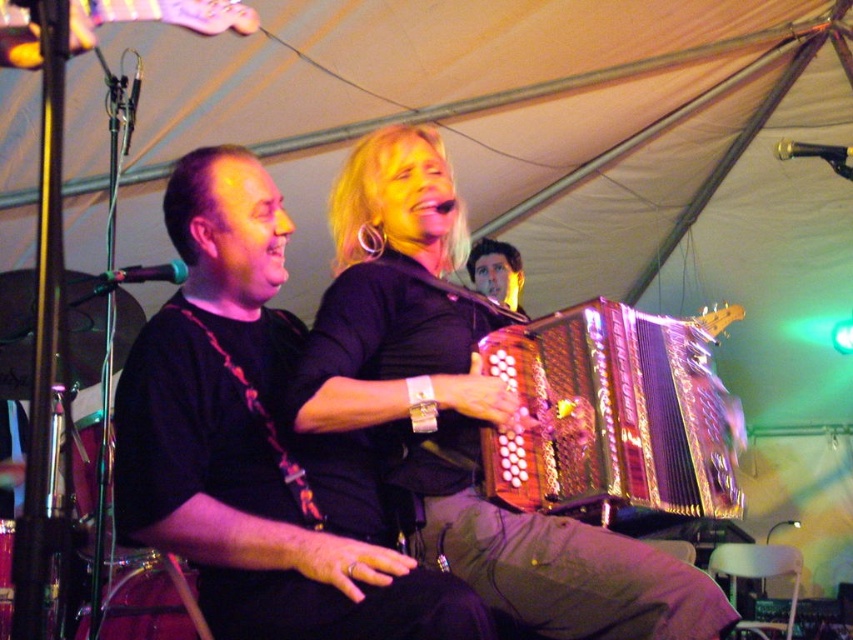
Question: Estimate the real-world distances between objects in this image. Which object is closer to the metallic pink guitar at upper left?

Choices:
 (A) black fabric shirt at center
 (B) gold metallic accordion at center
 (C) shiny black hair at upper center

Answer: (A)

Question: Which of the following is the farthest from the observer?

Choices:
 (A) (x=424, y=209)
 (B) (x=730, y=308)
 (C) (x=287, y=529)
 (D) (x=157, y=4)

Answer: (B)

Question: Where is black fabric shirt at center located in relation to metallic pink guitar at upper left in the image?

Choices:
 (A) below
 (B) above

Answer: (A)

Question: Considering the relative positions of black fabric shirt at center and gold metallic accordion at center in the image provided, where is black fabric shirt at center located with respect to gold metallic accordion at center?

Choices:
 (A) right
 (B) left

Answer: (B)

Question: Does black fabric shirt at center appear under gold metallic accordion at center?

Choices:
 (A) no
 (B) yes

Answer: (B)

Question: Which point appears farthest from the camera in this image?

Choices:
 (A) (659, 422)
 (B) (360, 326)
 (C) (142, 426)

Answer: (A)